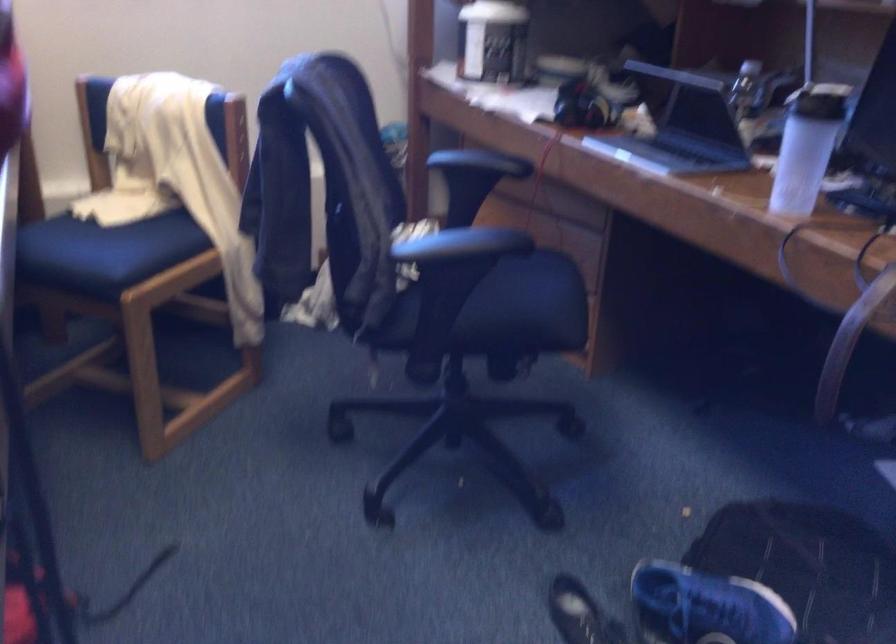
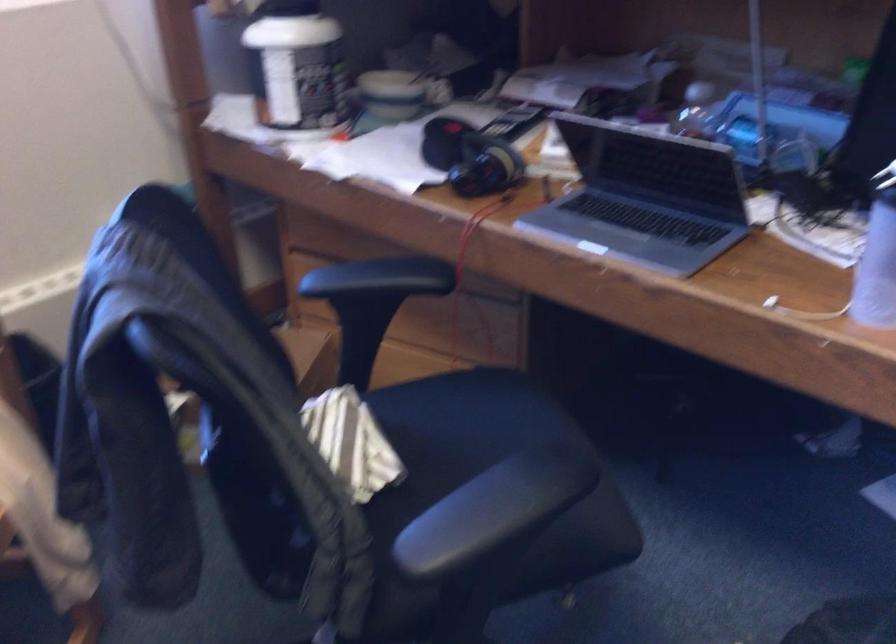
The images are taken continuously from a first-person perspective. In which direction are you moving?

The cameraman moved toward left, forward.